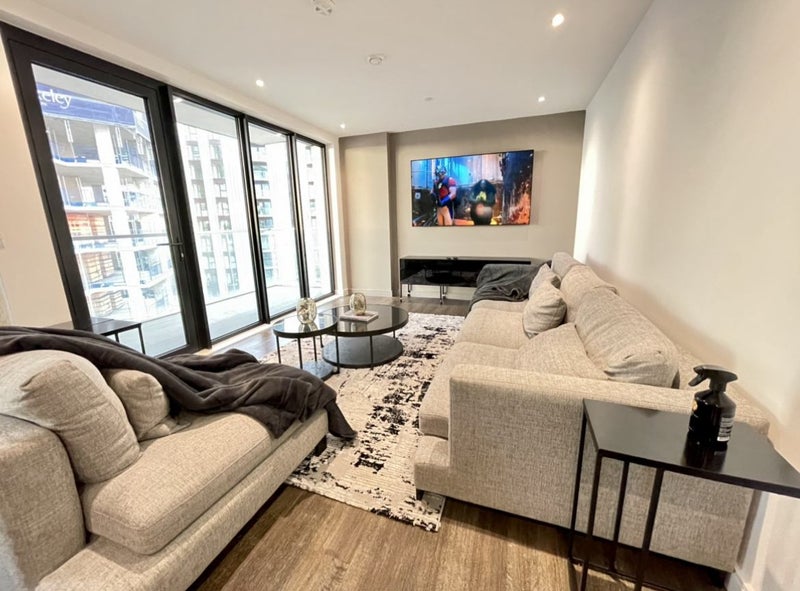
Find the location of a particular element. This screenshot has height=591, width=800. glass door is located at coordinates (113, 230).